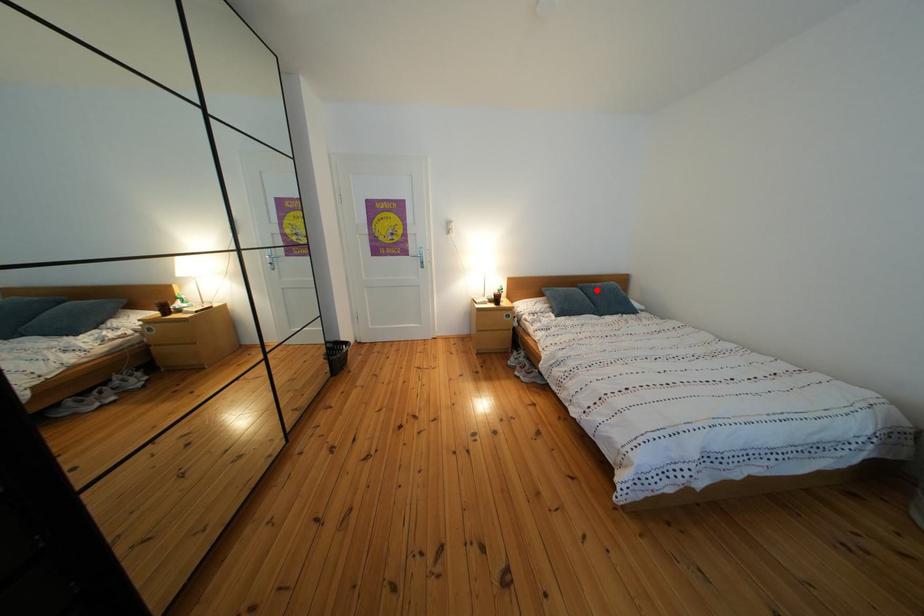
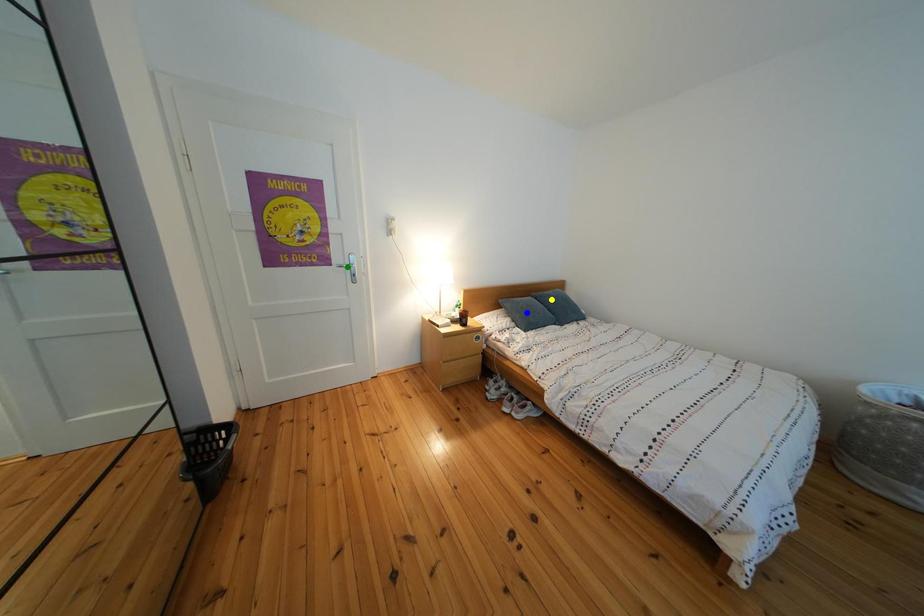
Question: I am providing you with two images of the same scene from different viewpoints. A red point is marked on the first image. You are given multiple points on the second image. Which point in image 2 represents the same 3d spot as the red point in image 1?

Choices:
 (A) blue point
 (B) yellow point
 (C) green point

Answer: (B)